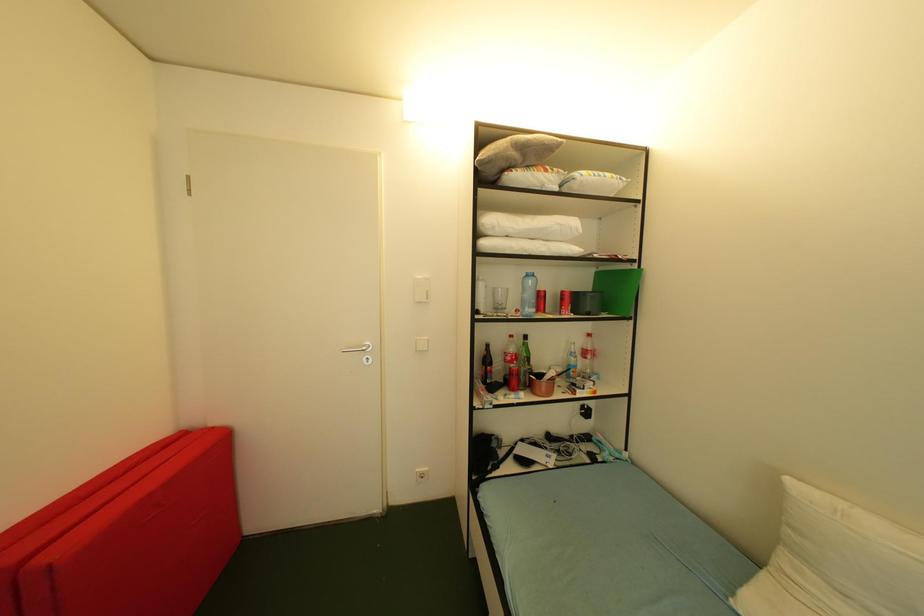
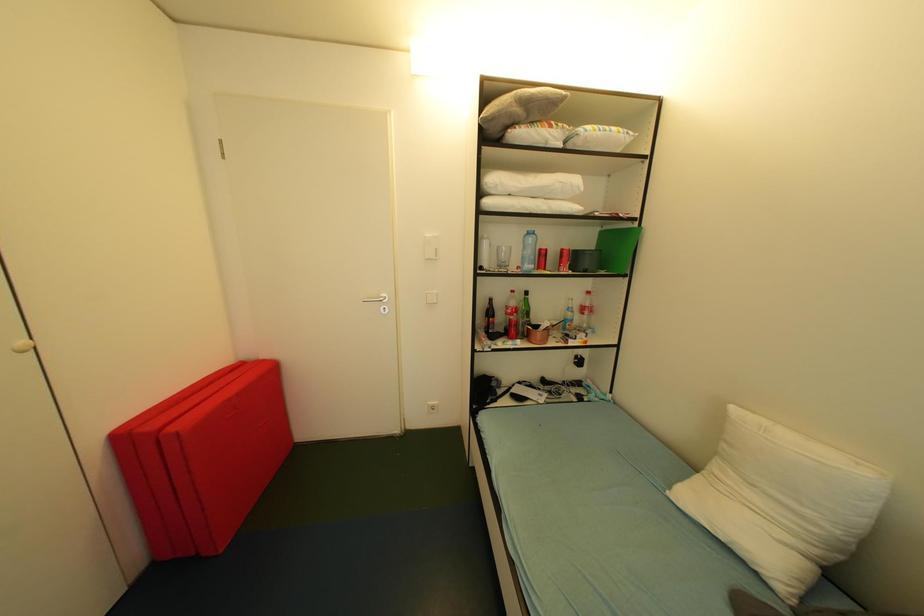
In a continuous first-person perspective shot, in which direction is the camera moving?

The cameraman walked toward right, backward.